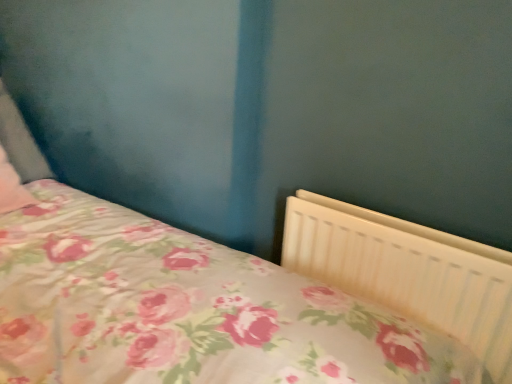
Locate an element on the screen. free space above white plastic radiator at lower right (from a real-world perspective) is located at coordinates (421, 229).